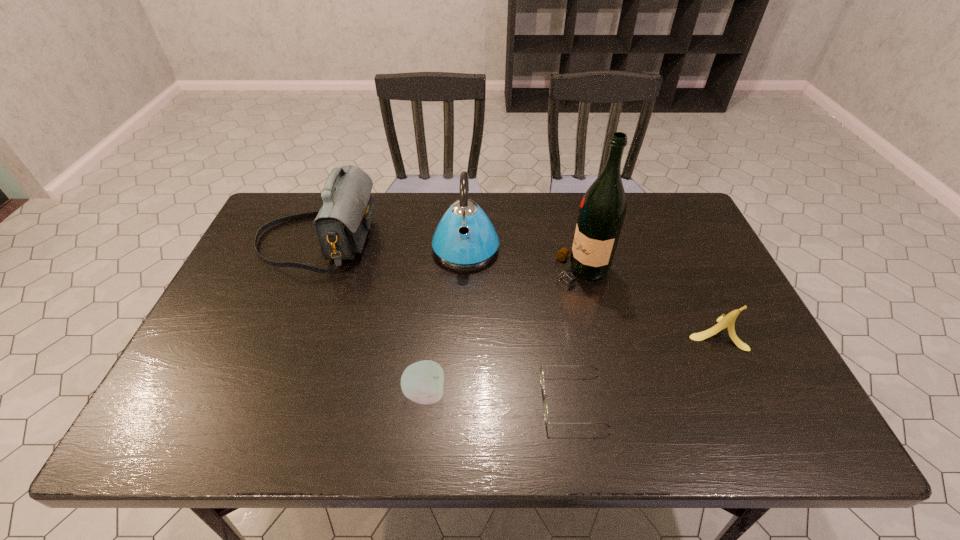
Select which object appears as the fifth closest to the shoulder bag. Please provide its 2D coordinates. Your answer should be formatted as a tuple, i.e. [(x, y)], where the tuple contains the x and y coordinates of a point satisfying the conditions above.

[(728, 321)]

This screenshot has height=540, width=960. In order to click on free region that satisfies the following two spatial constraints: 1. on the back side of the fourth farthest object; 2. on the left side of the apple in this screenshot , I will do `click(431, 332)`.

Find the location of a particular element. vacant area that satisfies the following two spatial constraints: 1. at the spout of the kettle; 2. on the right side of the rightmost object is located at coordinates (463, 332).

You are a GUI agent. You are given a task and a screenshot of the screen. Output one action in this format:
    pyautogui.click(x=<x>, y=<y>)
    Task: Click on the vacant area in the image that satisfies the following two spatial constraints: 1. at the spout of the rightmost object; 2. on the left side of the kettle
    
    Given the screenshot: What is the action you would take?
    pyautogui.click(x=463, y=332)

Image resolution: width=960 pixels, height=540 pixels. I want to click on vacant region that satisfies the following two spatial constraints: 1. on the surface of the wine bottle; 2. on the left side of the banana, so pyautogui.click(x=595, y=332).